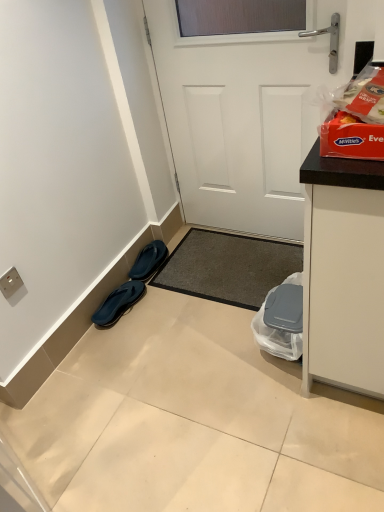
The width and height of the screenshot is (384, 512). Find the location of `free space above dark gray carpet at center (from a real-world perspective)`. free space above dark gray carpet at center (from a real-world perspective) is located at coordinates (231, 263).